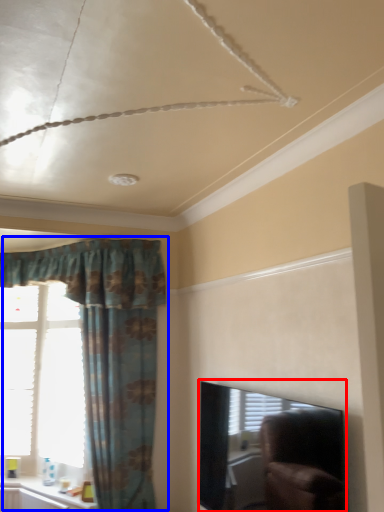
Question: Which of the following is the closest to the observer, window screen (highlighted by a red box) or curtain (highlighted by a blue box)?

Choices:
 (A) window screen
 (B) curtain

Answer: (A)